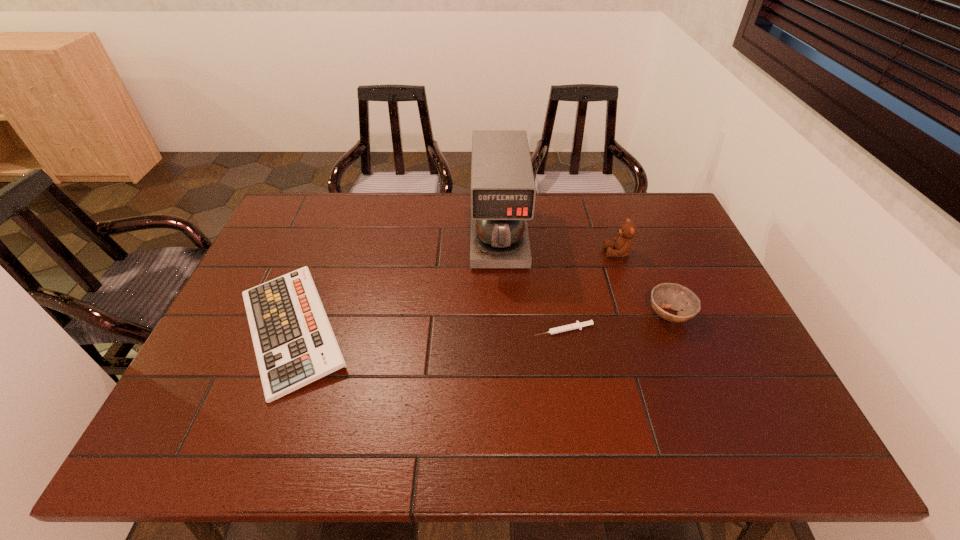
This screenshot has height=540, width=960. I want to click on blank area located on the right of the third shortest object, so [x=722, y=314].

At what (x,y) coordinates should I click in order to perform the action: click on vacant space located on the back of the fourth tallest object. Please return your answer as a coordinate pair (x, y). Looking at the image, I should click on (335, 219).

The image size is (960, 540). What are the coordinates of `blank space located on the back of the syringe` in the screenshot? It's located at (554, 273).

At what (x,y) coordinates should I click in order to perform the action: click on object situated at the far edge. Please return your answer as a coordinate pair (x, y). Looking at the image, I should click on (503, 191).

This screenshot has height=540, width=960. Find the location of `object at the left edge`. object at the left edge is located at coordinates (294, 343).

Where is `object that is positioned at the right edge`? object that is positioned at the right edge is located at coordinates (672, 296).

Identify the location of free space at the far edge of the desktop. (540, 230).

The height and width of the screenshot is (540, 960). Find the location of `free location at the left edge`. free location at the left edge is located at coordinates (252, 340).

At what (x,y) coordinates should I click in order to perform the action: click on free region at the right edge. Please return your answer as a coordinate pair (x, y). The width and height of the screenshot is (960, 540). Looking at the image, I should click on (716, 342).

Where is `blank space at the far left corner`? The height and width of the screenshot is (540, 960). blank space at the far left corner is located at coordinates (295, 231).